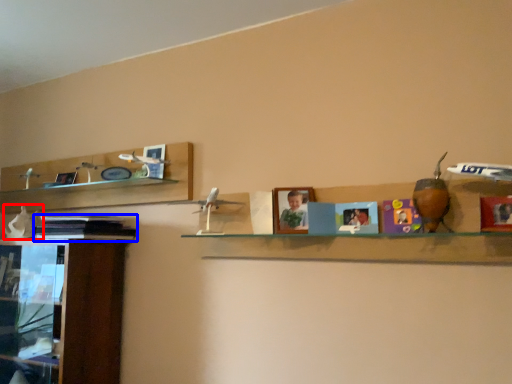
Question: Which object appears farthest to the camera in this image, toy (highlighted by a red box) or book (highlighted by a blue box)?

Choices:
 (A) toy
 (B) book

Answer: (A)